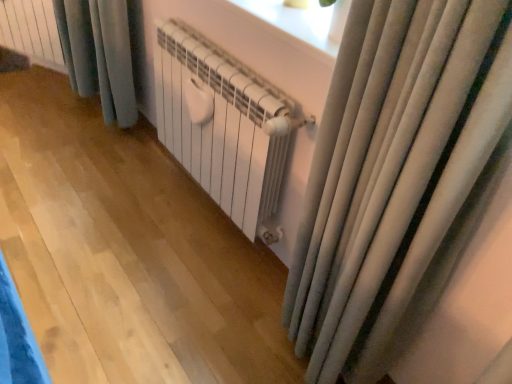
At what (x,y) coordinates should I click in order to perform the action: click on vacant space underneath white matte radiator at center, placed as the 2th radiator when sorted from back to front (from a real-world perspective). Please return your answer as a coordinate pair (x, y). The height and width of the screenshot is (384, 512). Looking at the image, I should click on (206, 214).